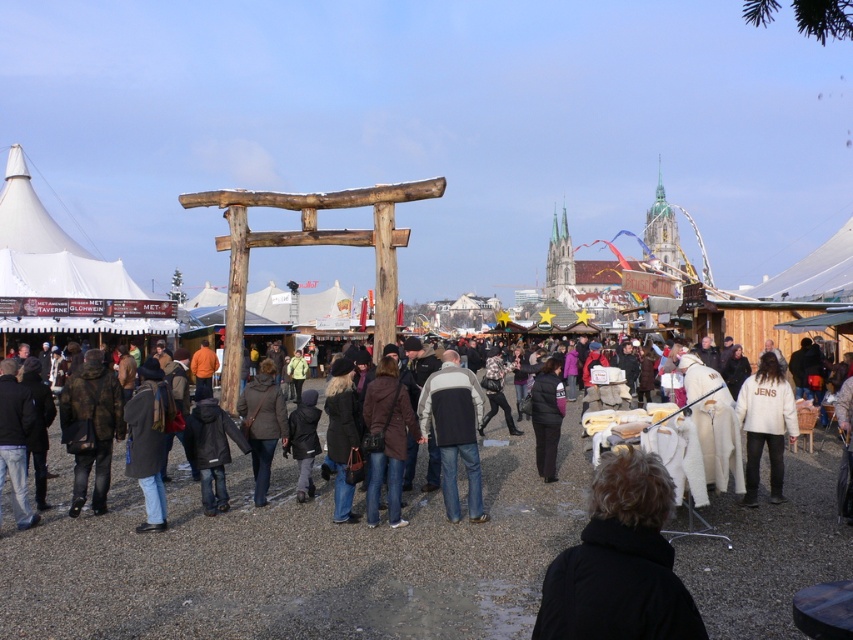
You are a photographer standing at the entrance of the market. You want to take a photo of the gray matte jacket at center to capture it clearly. Considering the distance, is it advisable to use a telephoto lens?

The gray matte jacket at center is 70.30 meters away from the camera. Using a telephoto lens would be advisable to capture it clearly from that distance.

You are a customer at the market and want to buy a coat. You see a black woolen coat at center and a white fleece jacket at right. Which one is closer to the ground?

The black woolen coat at center is below the white fleece jacket at right, so it is closer to the ground.

You are standing in the market and want to reach both the torii gate and a stall in the midground. Which point, point (437, 412) or point (749, 456), is closer to you?

Point (437, 412) is closer to you than point (749, 456) because it is further to the viewer.